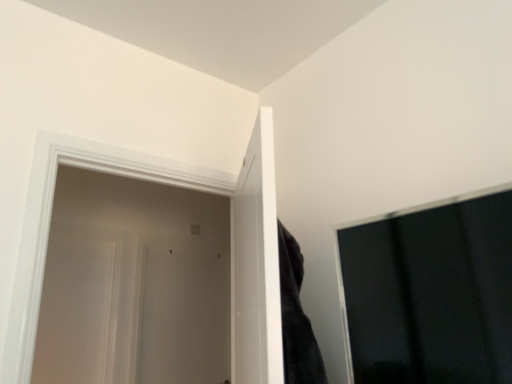
Question: Is white glossy door at left, which appears as the 1th door when viewed from the left, next to white matte door at center, which is counted as the 1th door, starting from the back?

Choices:
 (A) yes
 (B) no

Answer: (B)

Question: Is white glossy door at left, which appears as the second door when viewed from the back, closer to the viewer compared to white matte door at center, which is the 2th door from right to left?

Choices:
 (A) no
 (B) yes

Answer: (B)

Question: Can we say white glossy door at left, which appears as the second door when viewed from the back, lies outside white matte door at center, arranged as the 3th door when viewed from the front?

Choices:
 (A) no
 (B) yes

Answer: (B)

Question: Is white glossy door at left, the second door viewed from the front, far away from white matte door at center, positioned as the 2th door in left-to-right order?

Choices:
 (A) yes
 (B) no

Answer: (B)

Question: Can you confirm if white glossy door at left, which is the third door from right to left, is positioned to the right of white matte door at center, positioned as the 2th door in left-to-right order?

Choices:
 (A) no
 (B) yes

Answer: (A)

Question: Can you confirm if white glossy door at left, which is the third door from right to left, is bigger than white matte door at center, arranged as the 3th door when viewed from the front?

Choices:
 (A) no
 (B) yes

Answer: (A)

Question: Considering the relative sizes of white matte door at center, arranged as the 3th door when viewed from the front, and white glossy door at left, the first door positioned from the front, in the image provided, is white matte door at center, arranged as the 3th door when viewed from the front, bigger than white glossy door at left, the first door positioned from the front,?

Choices:
 (A) no
 (B) yes

Answer: (A)

Question: From the image's perspective, is white matte door at center, which is counted as the 1th door, starting from the back, below white glossy door at left, which is the third door in back-to-front order?

Choices:
 (A) yes
 (B) no

Answer: (A)

Question: Can you confirm if white matte door at center, positioned as the 2th door in left-to-right order, is shorter than white glossy door at left, the first door positioned from the front?

Choices:
 (A) yes
 (B) no

Answer: (B)

Question: From a real-world perspective, is white matte door at center, positioned as the 2th door in left-to-right order, physically above white glossy door at left, which is the third door in back-to-front order?

Choices:
 (A) yes
 (B) no

Answer: (B)

Question: Is white matte door at center, which is counted as the 1th door, starting from the back, thinner than white glossy door at left, the first door positioned from the front?

Choices:
 (A) yes
 (B) no

Answer: (A)

Question: Can you confirm if white matte door at center, which is counted as the 1th door, starting from the back, is positioned to the right of white glossy door at left, which is the third door in back-to-front order?

Choices:
 (A) no
 (B) yes

Answer: (A)

Question: Is white glossy door at left, which appears as the 1th door when viewed from the left, positioned beyond the bounds of white glossy door at left, the first door in the right-to-left sequence?

Choices:
 (A) yes
 (B) no

Answer: (A)